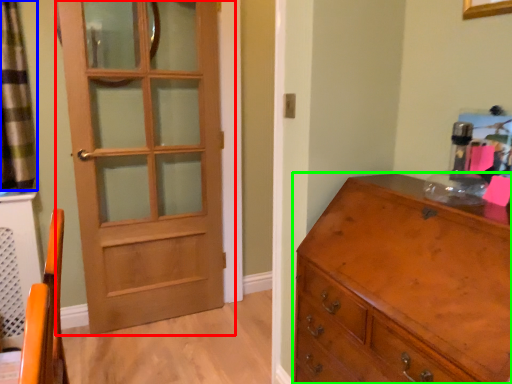
Question: Considering the real-world distances, which object is farthest from door (highlighted by a red box)? curtain (highlighted by a blue box) or chest of drawers (highlighted by a green box)?

Choices:
 (A) curtain
 (B) chest of drawers

Answer: (B)